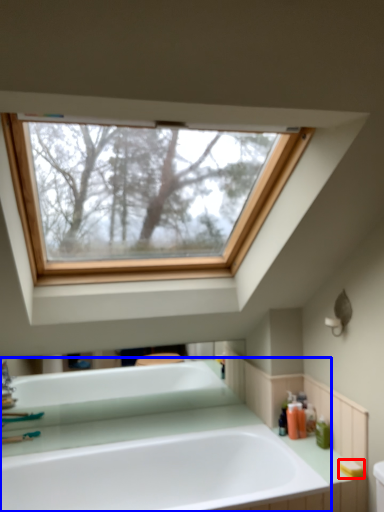
Question: Which object is further to the camera taking this photo, soap (highlighted by a red box) or bathtub (highlighted by a blue box)?

Choices:
 (A) soap
 (B) bathtub

Answer: (A)